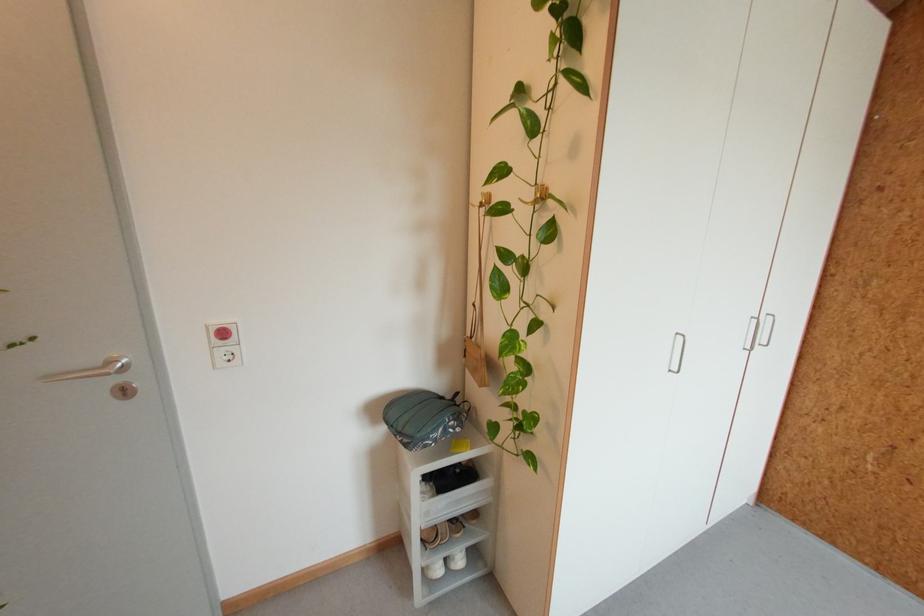
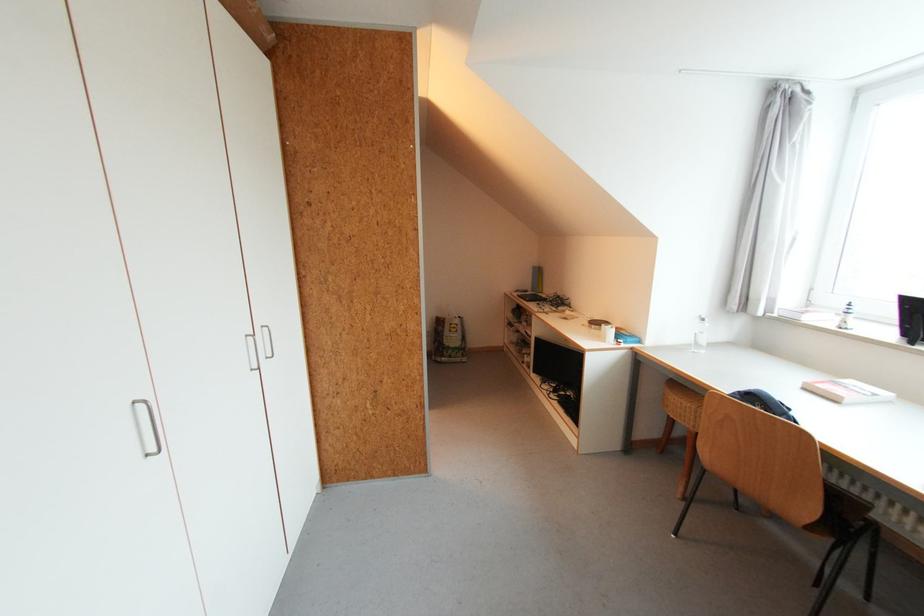
Locate, in the second image, the point that corresponds to (x=758, y=318) in the first image.

(251, 336)